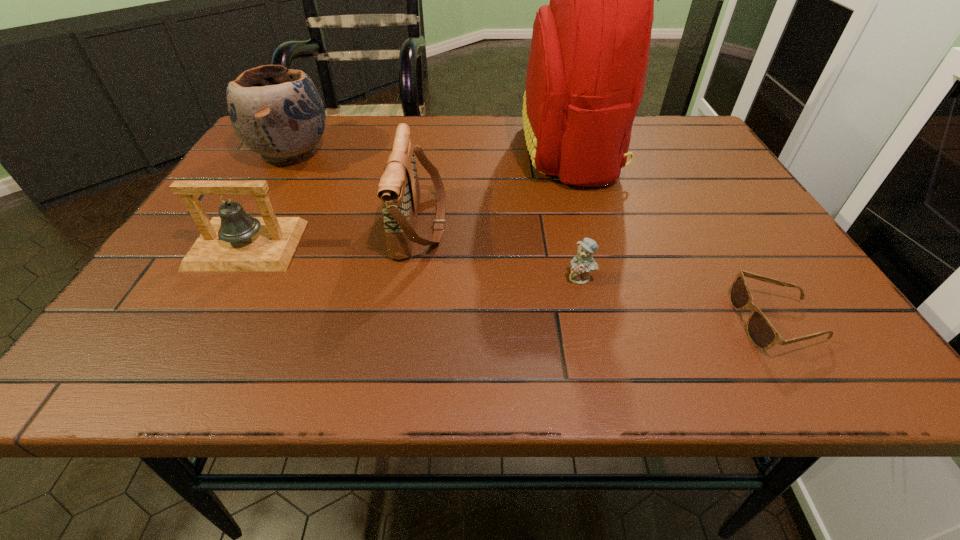
Where is `the tallest object`? the tallest object is located at coordinates (589, 55).

Find the location of a particular element. pottery is located at coordinates (276, 112).

Identify the location of shoulder bag. point(399,190).

Identify the location of the fourth tallest object. (235, 241).

Locate an element on the screen. This screenshot has width=960, height=540. teddy bear is located at coordinates (583, 263).

The height and width of the screenshot is (540, 960). Identify the location of the shortest object. (763, 335).

I want to click on the nearest object, so click(763, 335).

The height and width of the screenshot is (540, 960). What are the coordinates of `vacant space located 0.270m on the front-facing side of the backpack` in the screenshot? It's located at [415, 150].

The height and width of the screenshot is (540, 960). I want to click on free space located 0.320m on the front-facing side of the backpack, so click(396, 150).

Where is `free spot located on the front-facing side of the backpack`? Image resolution: width=960 pixels, height=540 pixels. free spot located on the front-facing side of the backpack is located at coordinates (454, 150).